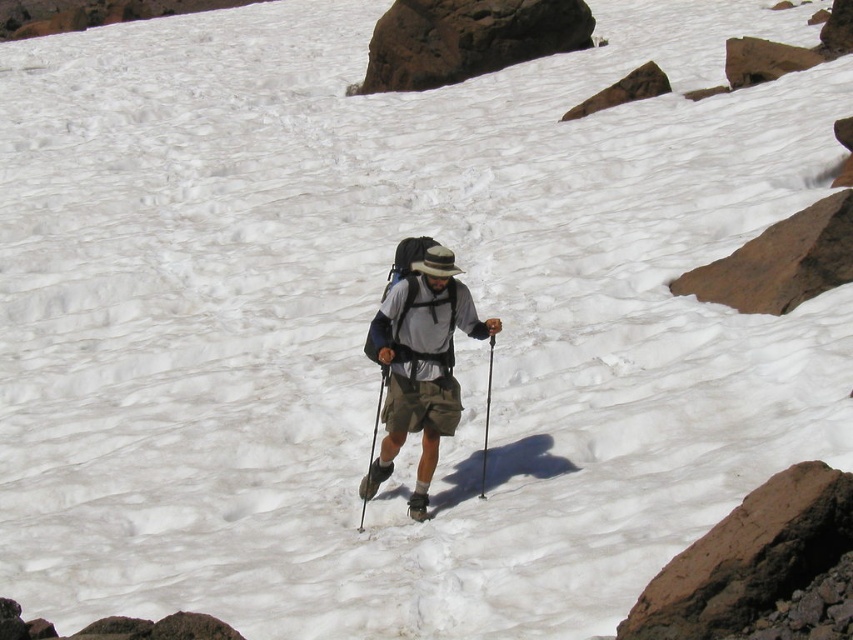
Is brown rough rock at lower right taller than black plastic ski pole at center?

Incorrect, brown rough rock at lower right's height is not larger of black plastic ski pole at center's.

Is brown rough rock at lower right to the left of black plastic ski pole at center from the viewer's perspective?

In fact, brown rough rock at lower right is to the right of black plastic ski pole at center.

Between point (817, 472) and point (375, 433), which one is positioned in front?

Point (817, 472)

Where is `brown rough rock at lower right`? The width and height of the screenshot is (853, 640). brown rough rock at lower right is located at coordinates (730, 552).

Can you confirm if brown rough rock at upper center is positioned to the left of metallic silver ski pole at center?

No, brown rough rock at upper center is not to the left of metallic silver ski pole at center.

Can you confirm if brown rough rock at upper center is wider than metallic silver ski pole at center?

Yes.

Is point (577, 49) closer to camera compared to point (486, 390)?

No, it is not.

Identify the location of brown rough rock at upper center. The width and height of the screenshot is (853, 640). (467, 38).

Can you confirm if brown rough rock at lower right is shorter than brown rock at upper right?

Indeed, brown rough rock at lower right has a lesser height compared to brown rock at upper right.

Identify the location of brown rough rock at lower right. [730, 552].

Does point (695, 600) come behind point (809, 284)?

No, it is not.

Find the location of a particular element. The width and height of the screenshot is (853, 640). brown rough rock at lower right is located at coordinates (730, 552).